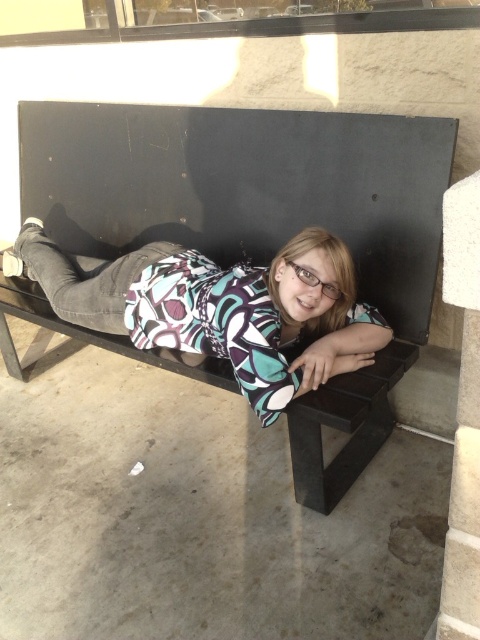
Is point (121, 166) less distant than point (40, 243)?

No, (121, 166) is further to viewer.

Between matte black bench at center and matte black shirt at center, which one is positioned higher?

matte black bench at center

Is point (237, 200) closer to camera compared to point (313, 348)?

No, it is not.

Locate an element on the screen. matte black bench at center is located at coordinates (261, 221).